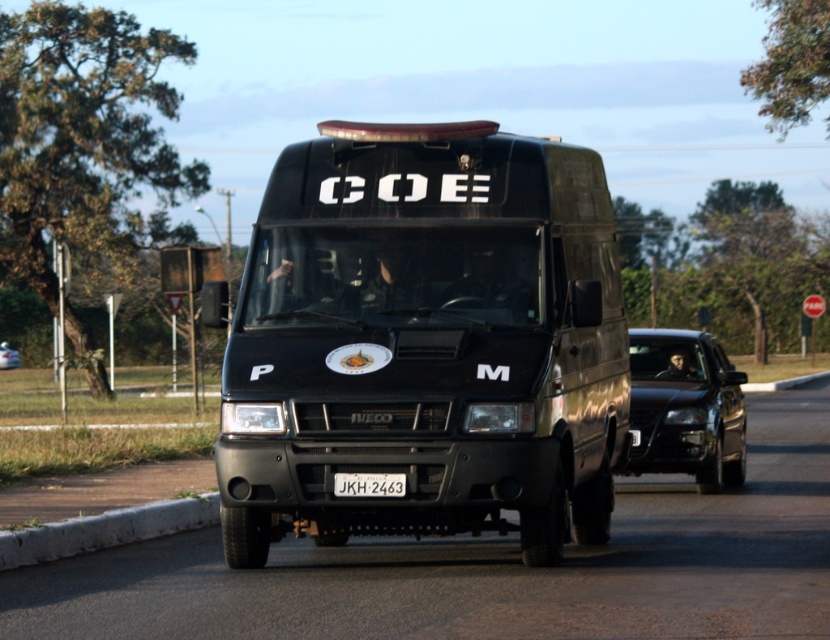
Which of these two, black glossy sedan at center or white plastic license plate at center, stands shorter?

With less height is white plastic license plate at center.

Between black glossy sedan at center and white plastic license plate at center, which one is positioned lower?

white plastic license plate at center

Which is in front, point (670, 445) or point (352, 490)?

Point (352, 490)

This screenshot has height=640, width=830. In order to click on black glossy sedan at center in this screenshot , I will do `click(686, 406)`.

Who is positioned more to the left, black matte van at center or white plastic license plate at center?

From the viewer's perspective, white plastic license plate at center appears more on the left side.

Between point (391, 180) and point (359, 483), which one is positioned in front?

Point (359, 483) is more forward.

This screenshot has width=830, height=640. Find the location of `black matte van at center`. black matte van at center is located at coordinates (425, 342).

Which is behind, point (354, 486) or point (11, 353)?

The point (11, 353) is behind.

Is white plastic license plate at center thinner than satin black van at center?

Yes, white plastic license plate at center is thinner than satin black van at center.

The image size is (830, 640). I want to click on white plastic license plate at center, so click(369, 484).

Locate an element on the screen. white plastic license plate at center is located at coordinates (369, 484).